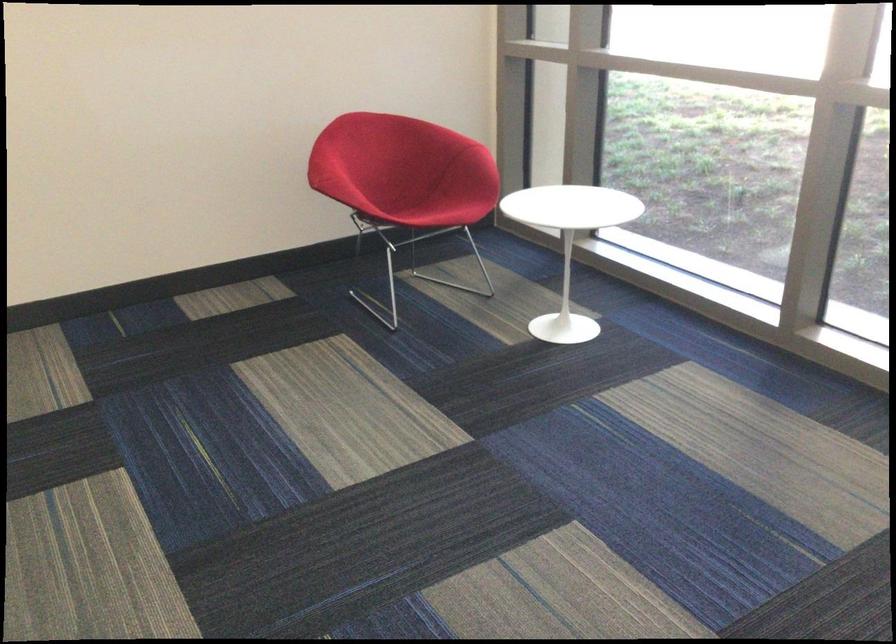
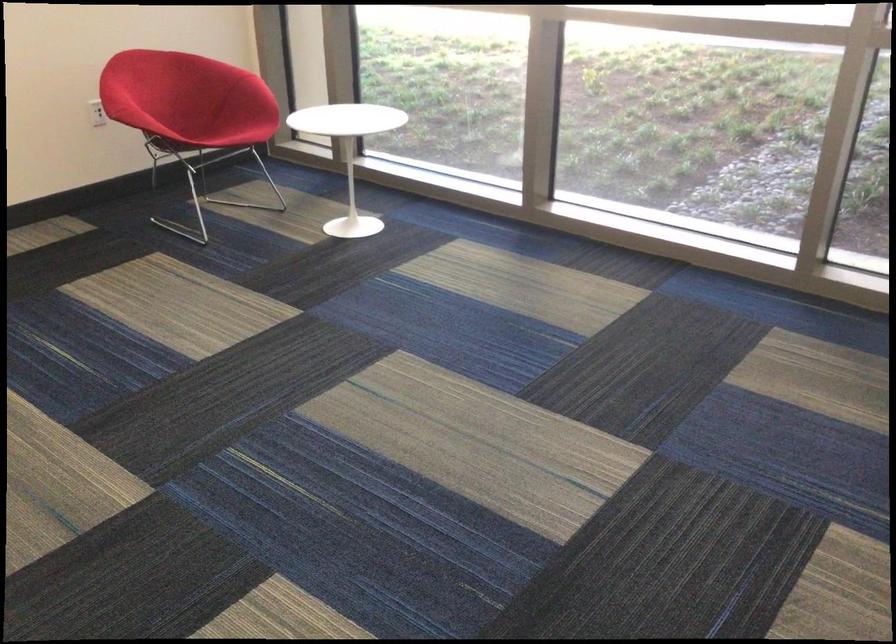
What movement of the cameraman would produce the second image?

The cameraman moved toward left, backward.